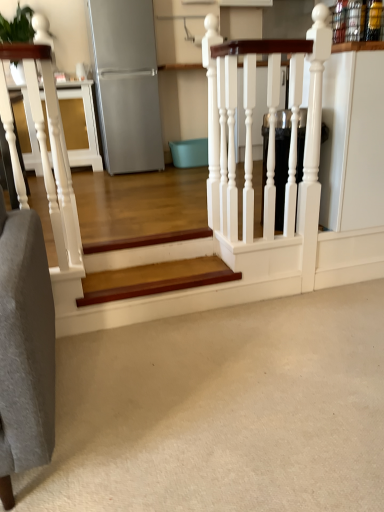
In order to click on empty space that is ontop of white carpet at lower center (from a real-world perspective) in this screenshot , I will do 242,381.